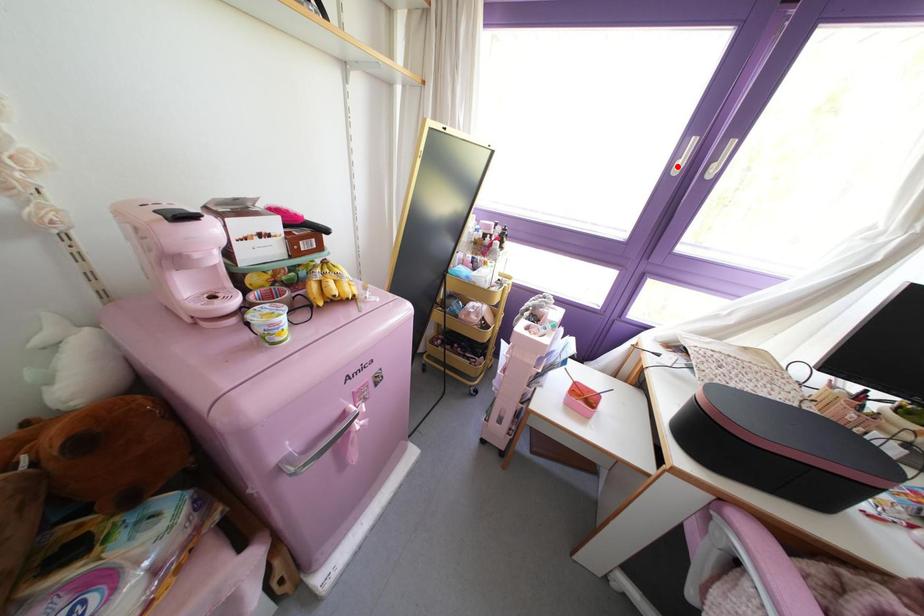
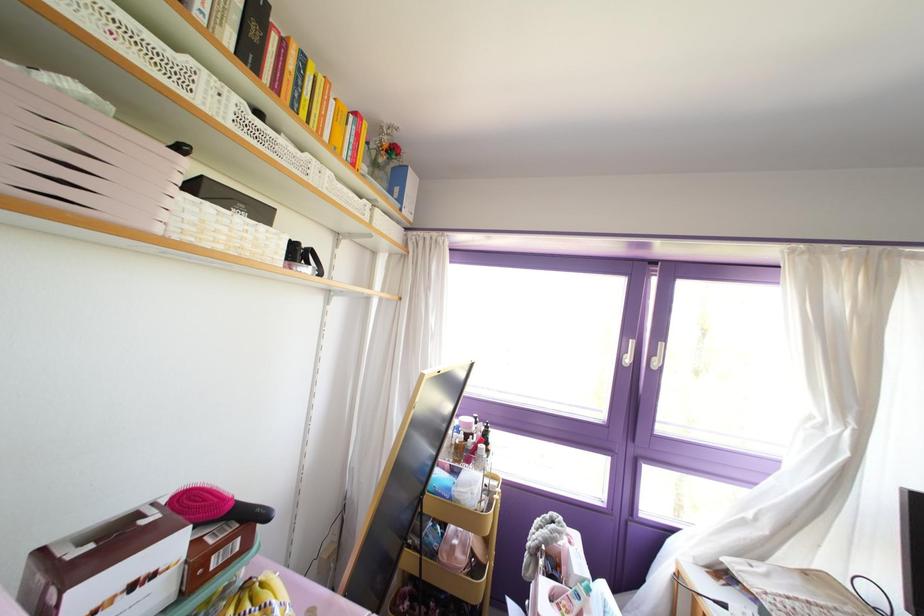
Find the pixel in the second image that matches the highlighted location in the first image.

(626, 360)